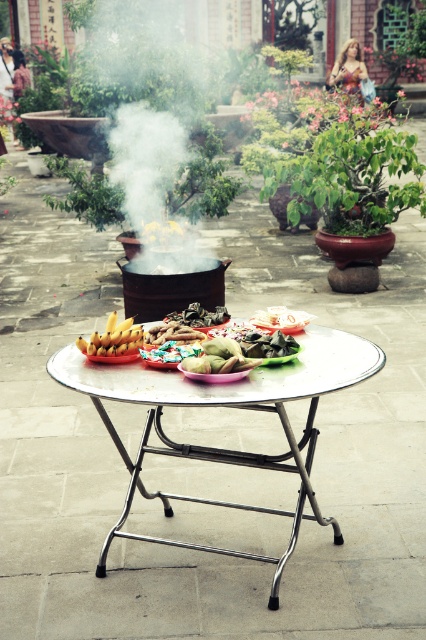
Question: Considering the real-world distances, which object is farthest from the white smoke at center?

Choices:
 (A) green matte vegetable at center
 (B) shiny metallic candy at center

Answer: (B)

Question: Based on their relative distances, which object is nearer to the green matte food at center?

Choices:
 (A) matte brown paper at center
 (B) white smoke at center
 (C) golden fried snack at center
 (D) shiny silver chopsticks at center

Answer: (D)

Question: Is metallic silver table at center thinner than dark brown glossy leaves at center?

Choices:
 (A) yes
 (B) no

Answer: (B)

Question: Does green matte food at center have a larger size compared to golden fried snack at center?

Choices:
 (A) yes
 (B) no

Answer: (A)

Question: Does white smoke at center have a larger size compared to shiny silver chopsticks at center?

Choices:
 (A) no
 (B) yes

Answer: (B)

Question: Which point is closer to the camera?

Choices:
 (A) (181, 323)
 (B) (138, 60)
 (C) (187, 541)

Answer: (C)